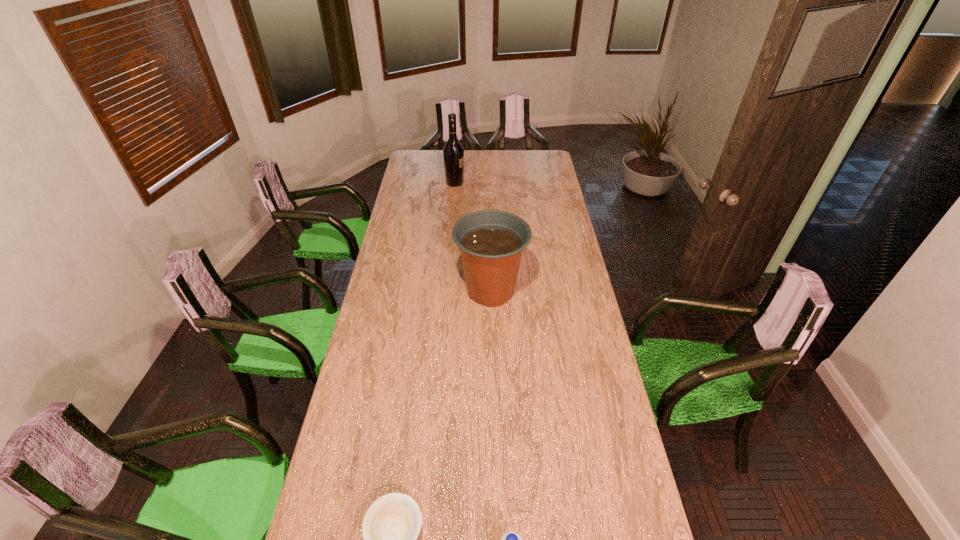
I want to click on the farthest object, so click(453, 153).

Find the location of a particular element. This screenshot has width=960, height=540. wine bottle is located at coordinates (453, 153).

You are a GUI agent. You are given a task and a screenshot of the screen. Output one action in this format:
    pyautogui.click(x=<x>, y=<y>)
    Task: Click on the second tallest object
    
    Given the screenshot: What is the action you would take?
    pyautogui.click(x=491, y=242)

Locate an element on the screen. the second farthest object is located at coordinates (491, 242).

This screenshot has width=960, height=540. I want to click on vacant region located on the label of the tallest object, so click(478, 183).

Where is `vacant space positioned 0.090m on the left of the flowerpot`? The image size is (960, 540). vacant space positioned 0.090m on the left of the flowerpot is located at coordinates (434, 291).

Find the location of a particular element. The image size is (960, 540). vacant space at the left edge of the desktop is located at coordinates (380, 281).

In the image, there is a desktop. What are the coordinates of `free space at the right edge` in the screenshot? It's located at (557, 188).

Identify the location of object that ranks as the closest to the farthest object. The image size is (960, 540). (491, 242).

At what (x,y) coordinates should I click in order to perform the action: click on object that is the closest to the second farthest object. Please return your answer as a coordinate pair (x, y). Looking at the image, I should click on (453, 153).